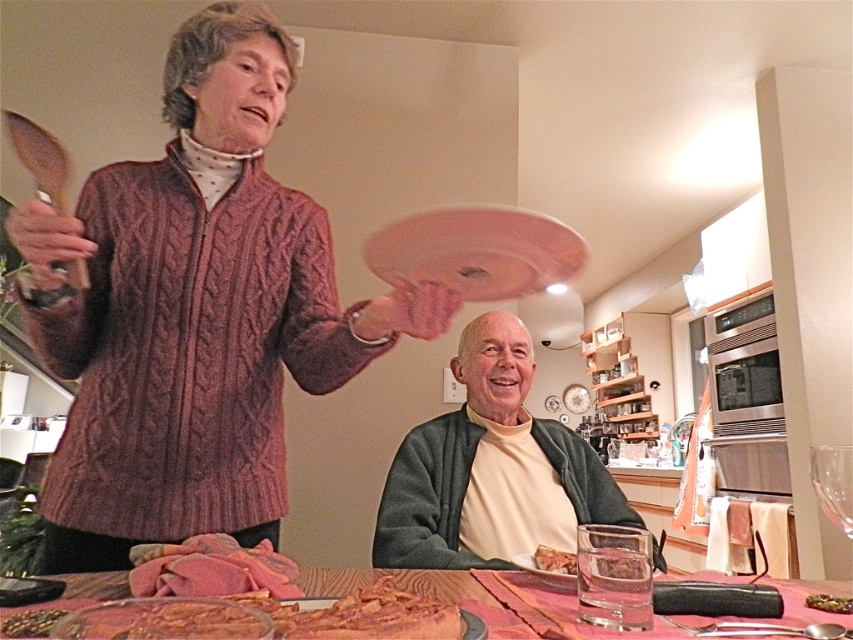
Based on the photo, does wooden table at center have a greater width compared to shiny golden seeds at lower left?

Correct, the width of wooden table at center exceeds that of shiny golden seeds at lower left.

Looking at this image, does wooden table at center have a smaller size compared to shiny golden seeds at lower left?

No, wooden table at center is not smaller than shiny golden seeds at lower left.

Is point (670, 634) closer to viewer compared to point (59, 609)?

No, it is not.

This screenshot has width=853, height=640. What are the coordinates of `wooden table at center` in the screenshot? It's located at (471, 596).

Between cable-knit sweater at upper left and shiny golden seeds at lower left, which one has less height?

Standing shorter between the two is shiny golden seeds at lower left.

Which is behind, point (44, 508) or point (13, 628)?

The point (44, 508) is behind.

Where is `cable-knit sweater at upper left`? cable-knit sweater at upper left is located at coordinates (193, 312).

You are a GUI agent. You are given a task and a screenshot of the screen. Output one action in this format:
    pyautogui.click(x=<x>, y=<y>)
    Task: Click on the cable-knit sweater at upper left
    This screenshot has height=640, width=853.
    Given the screenshot: What is the action you would take?
    pyautogui.click(x=193, y=312)

Does golden brown crispy bacon at lower center have a greater height compared to transparent glass at table?

In fact, golden brown crispy bacon at lower center may be shorter than transparent glass at table.

Is golden brown crispy bacon at lower center to the left of transparent glass at table from the viewer's perspective?

Indeed, golden brown crispy bacon at lower center is positioned on the left side of transparent glass at table.

Identify the location of golden brown crispy bacon at lower center. This screenshot has height=640, width=853. (369, 616).

I want to click on golden brown crispy bacon at lower center, so click(x=369, y=616).